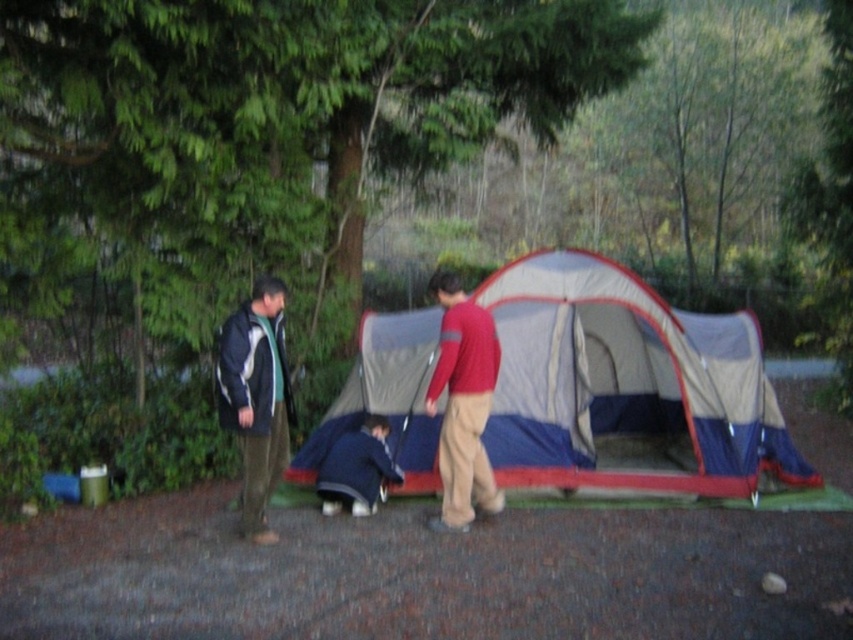
Where is `green leafy tree at upper center`? The height and width of the screenshot is (640, 853). green leafy tree at upper center is located at coordinates (262, 124).

The width and height of the screenshot is (853, 640). Describe the element at coordinates (262, 124) in the screenshot. I see `green leafy tree at upper center` at that location.

Where is `green leafy tree at upper center`? Image resolution: width=853 pixels, height=640 pixels. green leafy tree at upper center is located at coordinates (262, 124).

Which is behind, point (225, 252) or point (459, 356)?

The point (225, 252) is behind.

At what (x,y) coordinates should I click in order to perform the action: click on green leafy tree at upper center. Please return your answer as a coordinate pair (x, y). The image size is (853, 640). Looking at the image, I should click on (262, 124).

What do you see at coordinates (262, 124) in the screenshot?
I see `green leafy tree at upper center` at bounding box center [262, 124].

In order to click on green leafy tree at upper center in this screenshot , I will do `click(262, 124)`.

Between point (683, 364) and point (457, 412), which one is positioned in front?

Point (457, 412)

Does point (664, 486) come farther from viewer compared to point (451, 368)?

Yes.

The width and height of the screenshot is (853, 640). I want to click on blue fabric tent at center, so click(625, 387).